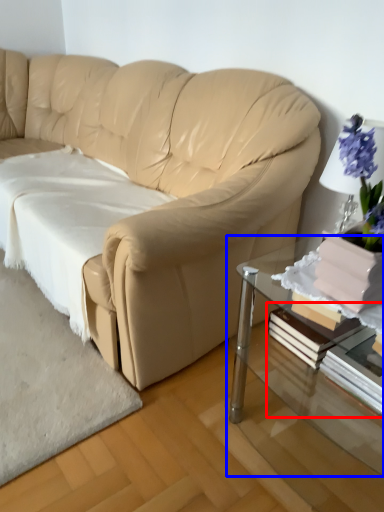
Question: Which object is further to the camera taking this photo, book (highlighted by a red box) or table (highlighted by a blue box)?

Choices:
 (A) book
 (B) table

Answer: (A)